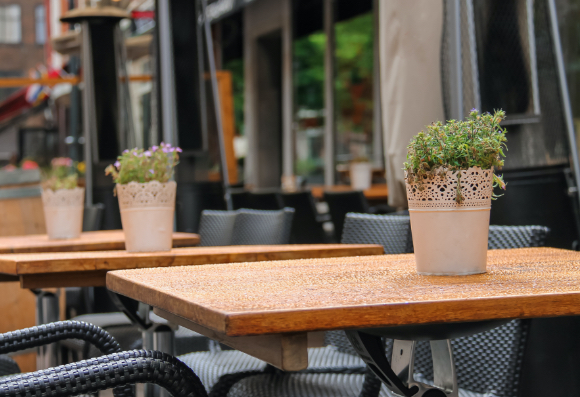
At what (x,y) coordinates should I click in order to perform the action: click on table by restaurant windowe. Please return your answer as a coordinate pair (x, y). The image size is (580, 397). Looking at the image, I should click on (x=291, y=183), (x=376, y=189), (x=318, y=190), (x=342, y=187).